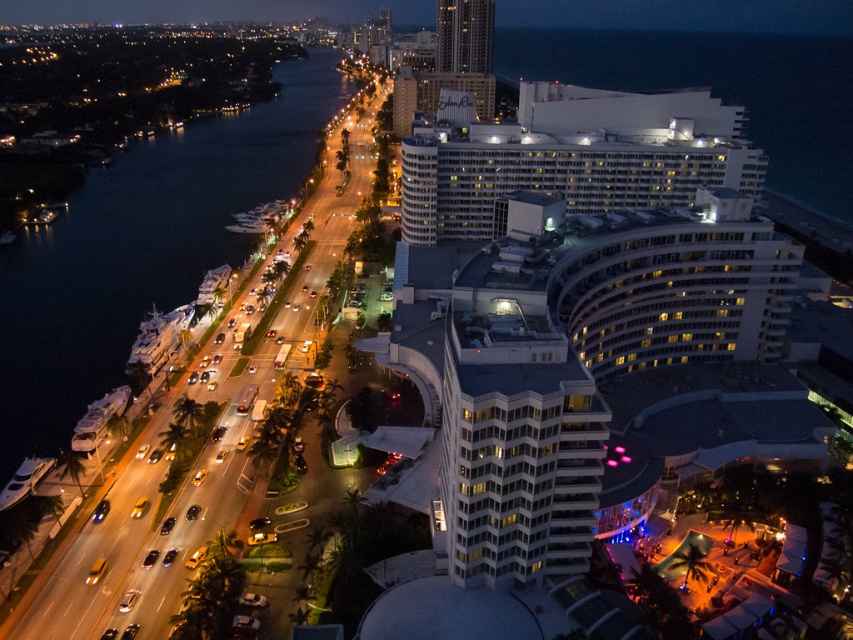
You are a drone operator trying to capture a photo of the dark blue water at left and the white glossy building at center from above. Based on their sizes in the image, which object should you focus on first to ensure both are visible in the frame?

The dark blue water at left is larger in size compared to the white glossy building at center, so you should focus on the dark blue water at left first to ensure both fit into the frame.

You are a drone operator tasked with capturing aerial footage of the waterfront. You need to fly your drone from the white glossy building at center to the white glass building at upper center. Which building should you fly towards first if you want to reach the taller one?

The white glass building at upper center is taller than the white glossy building at center, so you should fly towards the white glass building at upper center first.